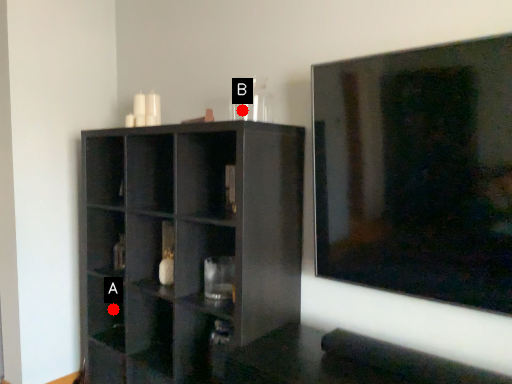
Question: Two points are circled on the image, labeled by A and B beside each circle. Among these points, which one is nearest to the camera?

Choices:
 (A) A is closer
 (B) B is closer

Answer: (B)